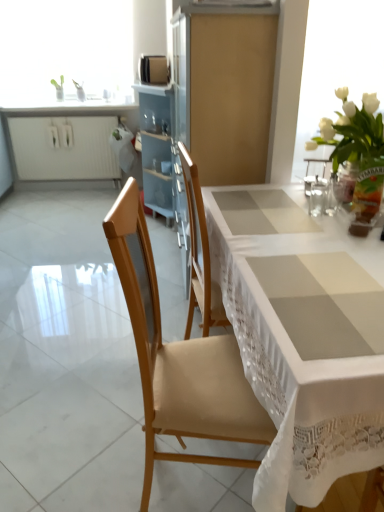
In order to click on white porcelain vase at upper right in this screenshot , I will do `click(357, 153)`.

What is the approximate width of white lace tablecloth at center?

white lace tablecloth at center is 1.37 meters in width.

What is the approximate width of white matte cabinet at upper left?

3.54 inches.

Where is `white glass vase at upper left`? This screenshot has height=512, width=384. white glass vase at upper left is located at coordinates coord(65,51).

Based on the photo, can clear glass water at upper right be found inside satin gold microwave at upper center?

No, clear glass water at upper right is not a part of satin gold microwave at upper center.

From the image's perspective, does satin gold microwave at upper center appear lower than clear glass water at upper right?

Incorrect, from the image's perspective, satin gold microwave at upper center is higher than clear glass water at upper right.

Is satin gold microwave at upper center further to the viewer compared to clear glass water at upper right?

Yes, it is.

Between point (162, 55) and point (315, 195), which one is positioned in front?

The point (315, 195) is in front.

Is point (314, 191) behind point (106, 18)?

No.

What are the coordinates of `tableware below the white glass vase at upper left (from a real-world perspective)` in the screenshot? It's located at (318, 197).

Between clear glass water at upper right and white glass vase at upper left, which one has larger size?

Bigger between the two is white glass vase at upper left.

In terms of size, does satin gold microwave at upper center appear bigger or smaller than white glossy countertop at upper left?

satin gold microwave at upper center is smaller than white glossy countertop at upper left.

From a real-world perspective, is satin gold microwave at upper center positioned over white glossy countertop at upper left based on gravity?

Yes.

Is point (148, 70) closer to viewer compared to point (86, 112)?

Yes, it is.

Choose the correct answer: Is satin gold microwave at upper center inside white glossy countertop at upper left or outside it?

satin gold microwave at upper center cannot be found inside white glossy countertop at upper left.

Is green glass vase at upper right facing towards wooden chair at center?

Yes.

Are green glass vase at upper right and wooden chair at center beside each other?

No, green glass vase at upper right is not touching wooden chair at center.

In the scene shown: Does green glass vase at upper right have a smaller size compared to wooden chair at center?

Yes.

Is green glass vase at upper right situated inside wooden chair at center or outside?

green glass vase at upper right is not inside wooden chair at center, it's outside.

Measure the distance between green glass vase at upper right and white matte cabinet at upper left.

A distance of 10.16 feet exists between green glass vase at upper right and white matte cabinet at upper left.

Considering the points (356, 207) and (103, 122), which point is in front, point (356, 207) or point (103, 122)?

Point (356, 207)

Looking at this image, is the depth of green glass vase at upper right greater than that of white matte cabinet at upper left?

No, it is in front of white matte cabinet at upper left.

Between white matte cabinet at upper left and clear glass water at upper right, which one has larger size?

white matte cabinet at upper left.

Is the surface of white matte cabinet at upper left in direct contact with clear glass water at upper right?

No, white matte cabinet at upper left is not with clear glass water at upper right.

From the image's perspective, between white matte cabinet at upper left and clear glass water at upper right, which one is located above?

white matte cabinet at upper left appears higher in the image.

Find the location of a particular element. The image size is (384, 512). tableware that appears below the white matte cabinet at upper left (from the image's perspective) is located at coordinates (318, 197).

From the picture: Is white porcelain vase at upper right inside or outside of white matte cabinet at upper left?

white porcelain vase at upper right lies outside white matte cabinet at upper left.

Is point (348, 106) closer or farther from the camera than point (18, 155)?

Point (348, 106) is positioned closer to the camera compared to point (18, 155).

Considering the sizes of white porcelain vase at upper right and white matte cabinet at upper left in the image, is white porcelain vase at upper right taller or shorter than white matte cabinet at upper left?

Clearly, white porcelain vase at upper right is shorter compared to white matte cabinet at upper left.

Measure the distance between white porcelain vase at upper right and white matte cabinet at upper left.

white porcelain vase at upper right is 8.63 feet from white matte cabinet at upper left.

What are the coordinates of `appliance that appears on the left of clear glass water at upper right` in the screenshot? It's located at (153, 69).

The image size is (384, 512). What are the coordinates of `window above the clear glass water at upper right (from a real-world perspective)` in the screenshot? It's located at (65, 51).

When comparing their distances from white porcelain vase at upper right, does white glossy countertop at upper left or clear glass water at upper right seem closer?

Based on the image, clear glass water at upper right appears to be nearer to white porcelain vase at upper right.

Which object lies nearer to the anchor point white porcelain vase at upper right, satin gold microwave at upper center or white matte cabinet at upper left?

satin gold microwave at upper center.

Considering their positions, is clear glass water at upper right positioned closer to white glass vase at upper left than wooden chair at center?

The object closer to white glass vase at upper left is clear glass water at upper right.

Estimate the real-world distances between objects in this image. Which object is closer to green glass vase at upper right, white porcelain vase at upper right or white glossy countertop at upper left?

The object closer to green glass vase at upper right is white porcelain vase at upper right.

Estimate the real-world distances between objects in this image. Which object is further from clear glass water at upper right, white matte cabinet at upper left or white glass vase at upper left?

white matte cabinet at upper left is further to clear glass water at upper right.

Looking at the image, which one is located closer to satin gold microwave at upper center, white glossy countertop at upper left or wooden chair at center?

Among the two, white glossy countertop at upper left is located nearer to satin gold microwave at upper center.

Estimate the real-world distances between objects in this image. Which object is closer to green glass vase at upper right, clear glass water at upper right or wooden chair at center?

The object closer to green glass vase at upper right is clear glass water at upper right.

From the image, which object appears to be nearer to white glass vase at upper left, satin gold microwave at upper center or white matte cabinet at upper left?

white matte cabinet at upper left.

Identify the location of vase between wooden chair at center and white glossy countertop at upper left from front to back. (361, 193).

Image resolution: width=384 pixels, height=512 pixels. What are the coordinates of `tableware between wooden chair at center and white glossy countertop at upper left from front to back` in the screenshot? It's located at (318, 197).

Where is `tableware positioned between white porcelain vase at upper right and white glass vase at upper left from near to far`? tableware positioned between white porcelain vase at upper right and white glass vase at upper left from near to far is located at coordinates (318, 197).

You are a GUI agent. You are given a task and a screenshot of the screen. Output one action in this format:
    pyautogui.click(x=<x>, y=<y>)
    Task: Click on the tableware between green glass vase at upper right and white glass vase at upper left along the z-axis
    The height and width of the screenshot is (512, 384).
    Given the screenshot: What is the action you would take?
    pyautogui.click(x=318, y=197)